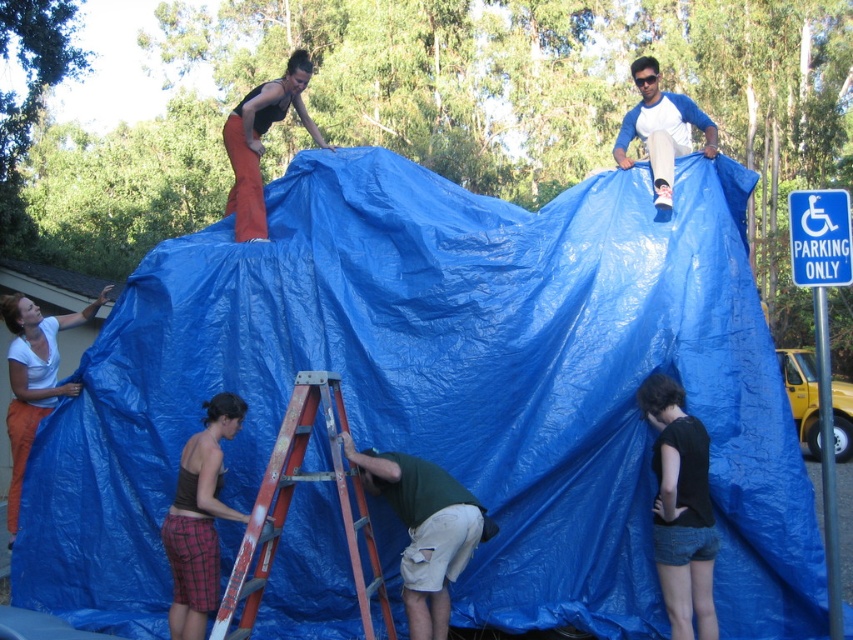
You are standing at the origin point of the coordinate system. You want to reach the plaid shorts at lower left. What direction should you move in?

The plaid shorts at lower left is located at coordinate point 0.812 in the x direction and 0.234 in the y direction. Since the origin is at the bottom left corner, moving towards positive x and positive y directions would reach the plaid shorts at lower left.

You are trying to determine which person is closer to you based on their clothing. The plaid shorts at lower left and the blue baseball shirt at upper right are both visible. Which clothing item belongs to the person who is closer to you?

The plaid shorts at lower left has a lesser width compared to the blue baseball shirt at upper right, so the person wearing plaid shorts at lower left is closer to you.